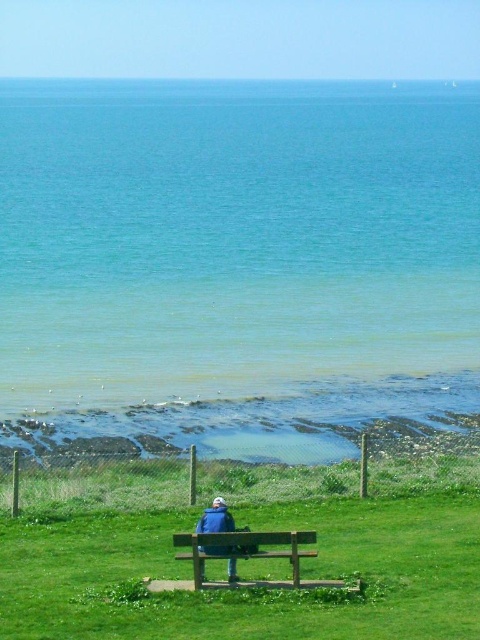
Question: Estimate the real-world distances between objects in this image. Which object is closer to the blue fabric jacket at center?

Choices:
 (A) clear blue water at center
 (B) green grassy bench at lower center
 (C) brown wooden bench at center

Answer: (C)

Question: Can you confirm if clear blue water at center is smaller than green grassy bench at lower center?

Choices:
 (A) no
 (B) yes

Answer: (A)

Question: Which object is the farthest from the green grassy bench at lower center?

Choices:
 (A) blue fabric jacket at center
 (B) clear blue water at center
 (C) brown wooden bench at center

Answer: (B)

Question: Is green grassy bench at lower center closer to the viewer compared to blue fabric jacket at center?

Choices:
 (A) no
 (B) yes

Answer: (A)

Question: Does clear blue water at center have a smaller size compared to brown wooden bench at center?

Choices:
 (A) yes
 (B) no

Answer: (B)

Question: Which object appears farthest from the camera in this image?

Choices:
 (A) blue fabric jacket at center
 (B) brown wooden bench at center
 (C) green grassy bench at lower center
 (D) clear blue water at center

Answer: (D)